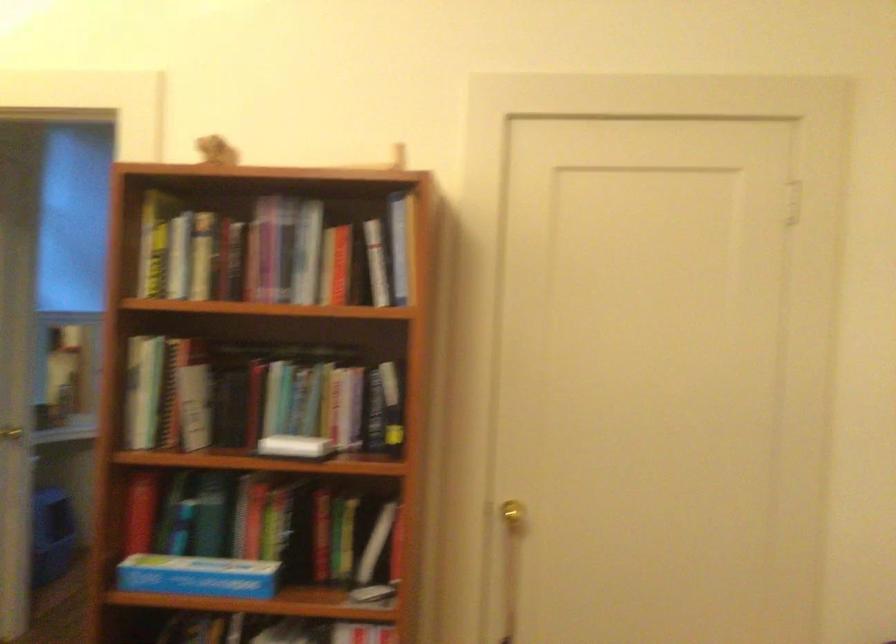
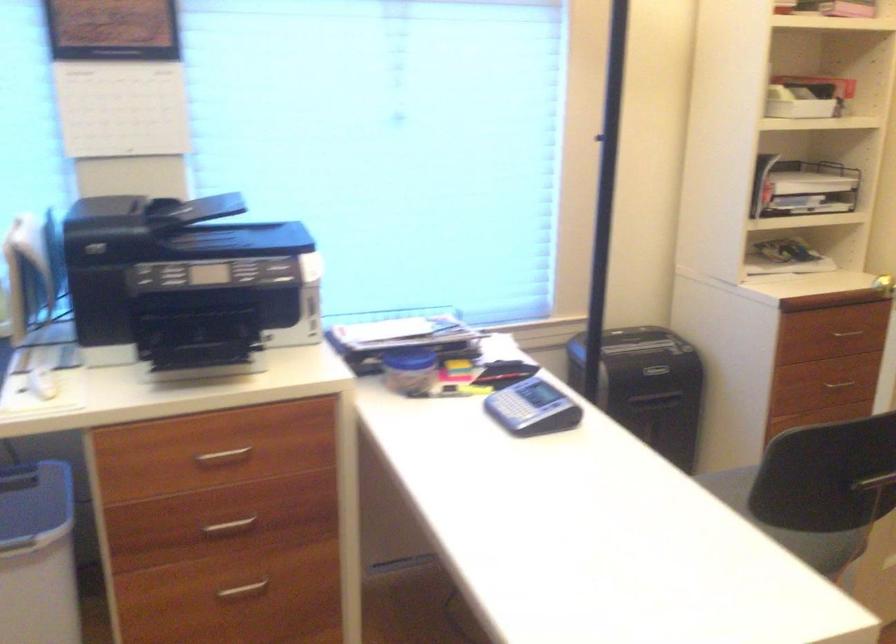
The first image is from the beginning of the video and the second image is from the end. How did the camera likely rotate when shooting the video?

The camera rotated toward left-down.